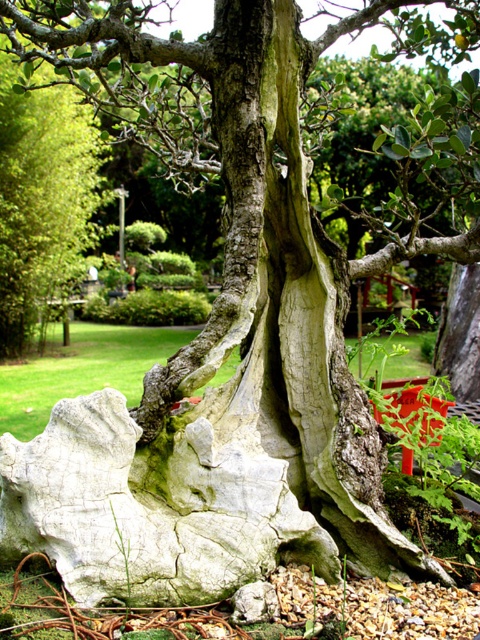
You are standing in front of the tree and looking at the two points marked in the image. Which point, point (62, 570) or point (4, 355), is closer to your eyes?

Point (62, 570) is closer to the camera than point (4, 355), so it is closer to your eyes.

You are an artist trying to sketch this scene. You have a small sketchbook and want to ensure both the white cracked rock at center and the smooth gray bark at center fit in your drawing. Based on their sizes, which object should you draw first to make sure they both fit?

The white cracked rock at center is smaller than the smooth gray bark at center, so you should draw the smooth gray bark at center first to ensure there is enough space for the smaller rock.

You are standing in front of the tree and want to place a small potted plant between the white cracked rock at center and the smooth gray bark at center. Can you do this without the plant touching either object?

The white cracked rock at center is positioned under smooth gray bark at center, so there is no space between them for the potted plant to be placed without touching either object.